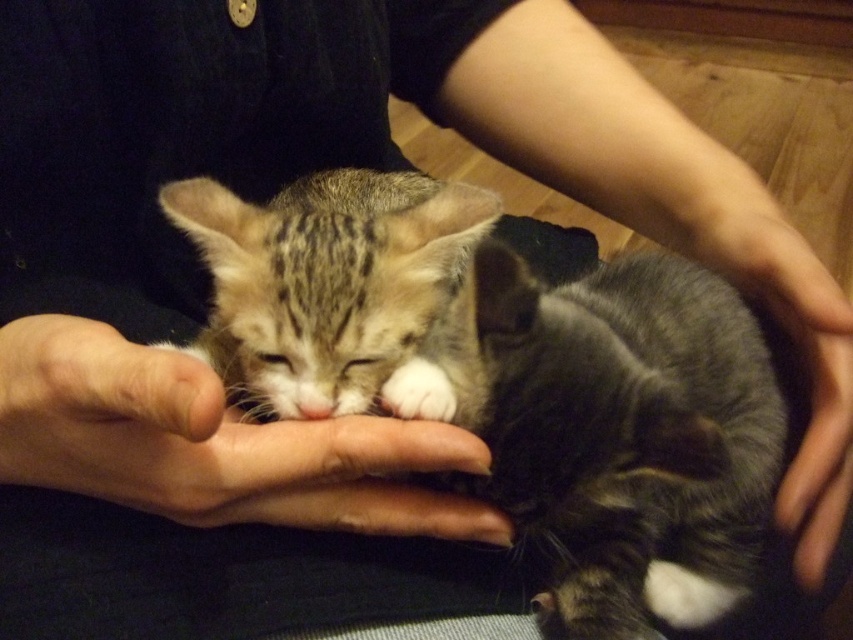
Does smooth skin hand at center have a greater width compared to tabby fur kitten at center?

Yes, smooth skin hand at center is wider than tabby fur kitten at center.

Who is more forward, (206,401) or (263,388)?

Positioned in front is point (206,401).

Where is `smooth skin hand at center`? This screenshot has height=640, width=853. smooth skin hand at center is located at coordinates (212, 444).

How much distance is there between tabby fur kitten at center and gray soft hand at lower right?

tabby fur kitten at center and gray soft hand at lower right are 22.82 centimeters apart from each other.

Can you confirm if tabby fur kitten at center is thinner than gray soft hand at lower right?

In fact, tabby fur kitten at center might be wider than gray soft hand at lower right.

Is point (264, 230) more distant than point (801, 445)?

No, it is in front of (801, 445).

I want to click on tabby fur kitten at center, so click(329, 285).

Can you confirm if smooth skin hand at center is bigger than gray soft hand at lower right?

No, smooth skin hand at center is not bigger than gray soft hand at lower right.

Can you confirm if smooth skin hand at center is wider than gray soft hand at lower right?

Correct, the width of smooth skin hand at center exceeds that of gray soft hand at lower right.

This screenshot has height=640, width=853. Identify the location of smooth skin hand at center. (212, 444).